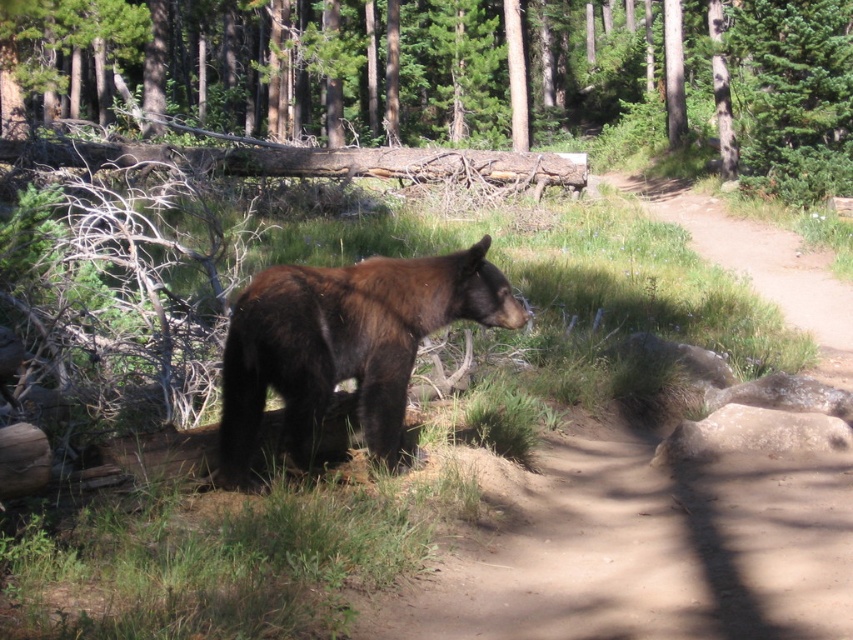
Question: Can you confirm if brown rough log at center is positioned below brown furry bear at center?

Choices:
 (A) no
 (B) yes

Answer: (A)

Question: Considering the relative positions of brown rough log at center and brown furry bear at center in the image provided, where is brown rough log at center located with respect to brown furry bear at center?

Choices:
 (A) left
 (B) right

Answer: (A)

Question: Among these objects, which one is nearest to the camera?

Choices:
 (A) brown furry bear at center
 (B) brown rough log at center

Answer: (A)

Question: Can you confirm if brown rough log at center is thinner than brown furry bear at center?

Choices:
 (A) no
 (B) yes

Answer: (A)

Question: Which object is farther from the camera taking this photo?

Choices:
 (A) brown furry bear at center
 (B) brown rough log at center

Answer: (B)